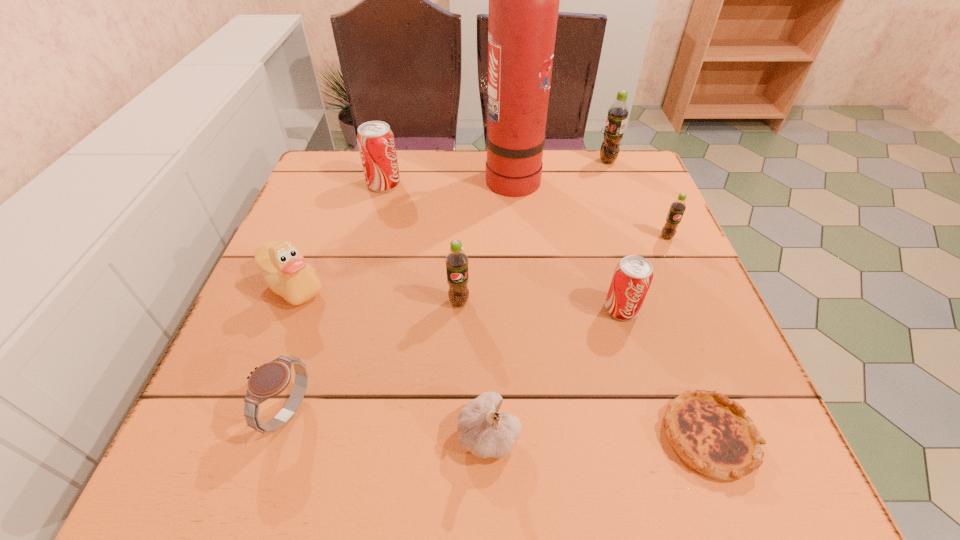
Locate an element on the screen. The height and width of the screenshot is (540, 960). the smallest green soda is located at coordinates (677, 208).

Identify the location of the third farthest soda. This screenshot has width=960, height=540. (677, 208).

You are a GUI agent. You are given a task and a screenshot of the screen. Output one action in this format:
    pyautogui.click(x=<x>, y=<y>)
    Task: Click on the garlic
    The height and width of the screenshot is (540, 960).
    Given the screenshot: What is the action you would take?
    pyautogui.click(x=483, y=431)

Identify the location of gray watch. click(268, 380).

This screenshot has width=960, height=540. Find the location of `the shortest object`. the shortest object is located at coordinates (712, 434).

Locate an element on the screen. The image size is (960, 540). free space located 0.170m on the label side of the tallest object is located at coordinates (421, 177).

In order to click on vacant space situated on the label side of the tallest object in this screenshot , I will do click(x=369, y=177).

This screenshot has width=960, height=540. Find the location of `free space located 0.100m on the label side of the tallest object`. free space located 0.100m on the label side of the tallest object is located at coordinates (447, 177).

The height and width of the screenshot is (540, 960). In order to click on vacant area situated 0.210m on the front label of the second tallest object in this screenshot , I will do `click(522, 161)`.

Identify the location of free space located 0.330m on the front label of the second tallest object. This screenshot has width=960, height=540. (478, 161).